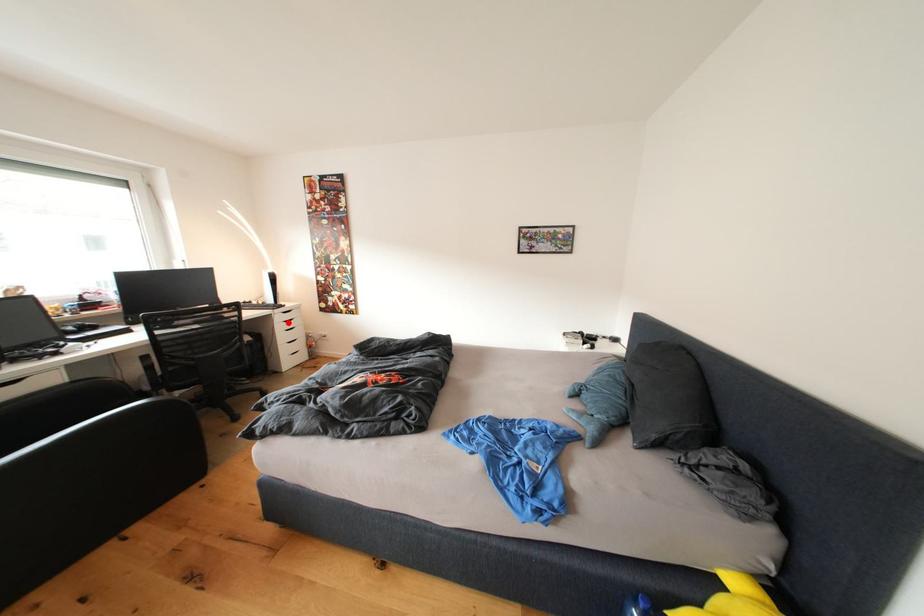
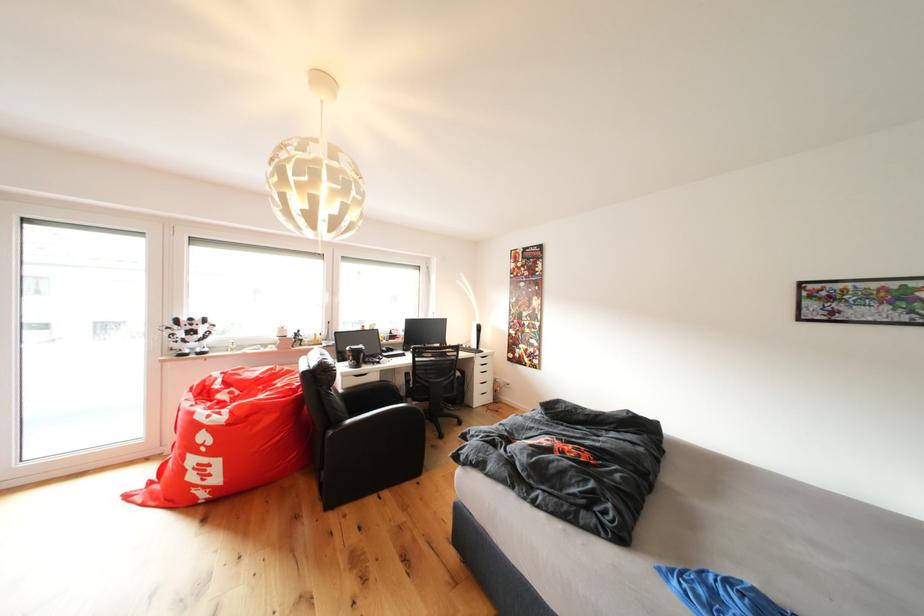
Question: I am providing you with two images of the same scene from different viewpoints. In image1, a red point is highlighted. Considering the same 3D point in image2, which of the following is correct?

Choices:
 (A) It is closer
 (B) It is farther

Answer: (B)